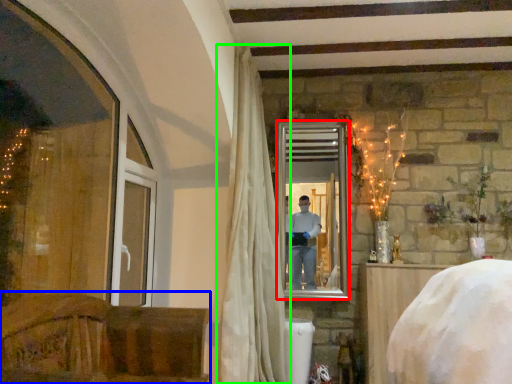
Question: Estimate the real-world distances between objects in this image. Which object is farther from mirror (highlighted by a red box), furniture (highlighted by a blue box) or curtain (highlighted by a green box)?

Choices:
 (A) furniture
 (B) curtain

Answer: (A)